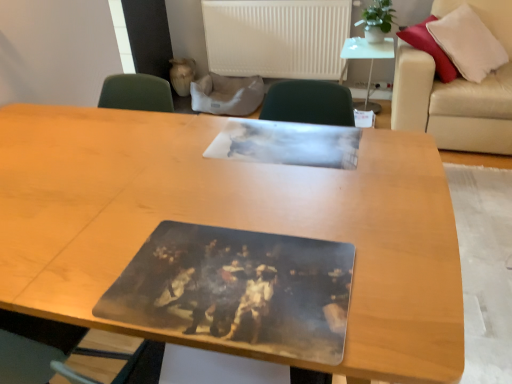
Identify the location of wooden table at center, the first table from the back. (366, 58).

Locate an element on the screen. beige leather couch at right is located at coordinates (457, 90).

From a real-world perspective, is wooden table at center, the first table from the back, physically above wooden table at center, positioned as the 2th table in right-to-left order?

Actually, wooden table at center, the first table from the back, is physically below wooden table at center, positioned as the 2th table in right-to-left order, in the real world.

Which object is further away from the camera taking this photo, wooden table at center, the second table positioned from the front, or wooden table at center, positioned as the 2th table in right-to-left order?

wooden table at center, the second table positioned from the front.

Considering the positions of objects wooden table at center, which is the second table from left to right, and wooden table at center, the 1th table ordered from the bottom, in the image provided, who is more to the left, wooden table at center, which is the second table from left to right, or wooden table at center, the 1th table ordered from the bottom,?

wooden table at center, the 1th table ordered from the bottom.

From the picture: Considering the sizes of objects wooden table at center, the first table from the back, and wooden table at center, arranged as the 1th table when viewed from the front, in the image provided, who is wider, wooden table at center, the first table from the back, or wooden table at center, arranged as the 1th table when viewed from the front,?

wooden table at center, arranged as the 1th table when viewed from the front, is wider.

Is wooden table at center, arranged as the second table when ordered from the bottom, directly adjacent to beige leather couch at right?

wooden table at center, arranged as the second table when ordered from the bottom, is not next to beige leather couch at right, and they're not touching.

Which is closer, (382, 57) or (473, 2)?

Point (382, 57) is farther from the camera than point (473, 2).

Considering the sizes of wooden table at center, the second table positioned from the front, and beige leather couch at right in the image, is wooden table at center, the second table positioned from the front, wider or thinner than beige leather couch at right?

Clearly, wooden table at center, the second table positioned from the front, has less width compared to beige leather couch at right.

Which object is more forward, wooden table at center, arranged as the second table when ordered from the bottom, or beige leather couch at right?

beige leather couch at right is closer to the camera.

From a real-world perspective, who is located higher, wooden table at center, which is the second table from left to right, or white matte radiator at upper center?

From a 3D spatial view, white matte radiator at upper center is above.

Considering the relative sizes of wooden table at center, the first table positioned from the top, and white matte radiator at upper center in the image provided, is wooden table at center, the first table positioned from the top, wider than white matte radiator at upper center?

Yes, wooden table at center, the first table positioned from the top, is wider than white matte radiator at upper center.

Consider the image. Considering the sizes of objects wooden table at center, arranged as the second table when ordered from the bottom, and white matte radiator at upper center in the image provided, who is taller, wooden table at center, arranged as the second table when ordered from the bottom, or white matte radiator at upper center?

white matte radiator at upper center is taller.

What's the angular difference between wooden table at center, which is the second table from left to right, and white matte radiator at upper center's facing directions?

0.454 degrees separate the facing orientations of wooden table at center, which is the second table from left to right, and white matte radiator at upper center.

From a real-world perspective, between beige leather couch at right and white matte radiator at upper center, who is vertically lower?

From a 3D spatial view, beige leather couch at right is below.

Is beige leather couch at right not close to white matte radiator at upper center?

Yes, beige leather couch at right and white matte radiator at upper center are quite far apart.

Is beige leather couch at right turned away from white matte radiator at upper center?

beige leather couch at right is not turned away from white matte radiator at upper center.

Is beige leather couch at right at the right side of white matte radiator at upper center?

Indeed, beige leather couch at right is positioned on the right side of white matte radiator at upper center.

From the image's perspective, which one is positioned higher, wooden table at center, arranged as the first table when viewed from the left, or beige leather couch at right?

beige leather couch at right.

Who is taller, wooden table at center, the 1th table ordered from the bottom, or beige leather couch at right?

Standing taller between the two is beige leather couch at right.

Is the position of wooden table at center, arranged as the first table when viewed from the left, less distant than that of beige leather couch at right?

Yes, it is in front of beige leather couch at right.

Is wooden table at center, arranged as the first table when viewed from the left, to the right of beige leather couch at right from the viewer's perspective?

No, wooden table at center, arranged as the first table when viewed from the left, is not to the right of beige leather couch at right.

Who is bigger, wooden table at center, the 1th table ordered from the bottom, or white matte radiator at upper center?

wooden table at center, the 1th table ordered from the bottom.

Is the depth of wooden table at center, the 1th table ordered from the bottom, less than that of white matte radiator at upper center?

Yes, wooden table at center, the 1th table ordered from the bottom, is closer to the viewer.

Is wooden table at center, arranged as the 1th table when viewed from the front, not within white matte radiator at upper center?

Absolutely, wooden table at center, arranged as the 1th table when viewed from the front, is external to white matte radiator at upper center.

Based on the photo, considering the sizes of objects wooden table at center, positioned as the 2th table in right-to-left order, and wooden table at center, which is the second table from left to right, in the image provided, who is bigger, wooden table at center, positioned as the 2th table in right-to-left order, or wooden table at center, which is the second table from left to right,?

wooden table at center, positioned as the 2th table in right-to-left order.

Is wooden table at center, arranged as the first table when viewed from the left, closer to the viewer compared to wooden table at center, which is the second table from left to right?

Yes, wooden table at center, arranged as the first table when viewed from the left, is closer to the camera.

Can you confirm if wooden table at center, the second table positioned from the top, is positioned to the right of wooden table at center, which is the second table from left to right?

No, wooden table at center, the second table positioned from the top, is not to the right of wooden table at center, which is the second table from left to right.

Which of these two, wooden table at center, marked as the 2th table in a back-to-front arrangement, or wooden table at center, arranged as the 1th table when viewed from the right, is wider?

wooden table at center, marked as the 2th table in a back-to-front arrangement, is wider.

The height and width of the screenshot is (384, 512). In order to click on table beneath the wooden table at center, the 1th table ordered from the bottom (from a real-world perspective) in this screenshot , I will do `click(366, 58)`.

Locate an element on the screen. table that is the 1st object located below the beige leather couch at right (from the image's perspective) is located at coordinates pyautogui.click(x=366, y=58).

Which object lies nearer to the anchor point beige leather couch at right, white matte radiator at upper center or wooden table at center, the second table positioned from the top?

The object closer to beige leather couch at right is white matte radiator at upper center.

Estimate the real-world distances between objects in this image. Which object is closer to white matte radiator at upper center, wooden table at center, the first table from the back, or wooden table at center, the second table positioned from the top?

wooden table at center, the first table from the back, is closer to white matte radiator at upper center.

Estimate the real-world distances between objects in this image. Which object is further from wooden table at center, the first table from the back, white matte radiator at upper center or wooden table at center, positioned as the 2th table in right-to-left order?

wooden table at center, positioned as the 2th table in right-to-left order.

Considering their positions, is beige leather couch at right positioned closer to wooden table at center, marked as the 2th table in a back-to-front arrangement, than wooden table at center, arranged as the 1th table when viewed from the right?

Among the two, beige leather couch at right is located nearer to wooden table at center, marked as the 2th table in a back-to-front arrangement.

From the image, which object appears to be nearer to wooden table at center, arranged as the first table when viewed from the left, wooden table at center, arranged as the second table when ordered from the bottom, or beige leather couch at right?

The object closer to wooden table at center, arranged as the first table when viewed from the left, is beige leather couch at right.

From the image, which object appears to be nearer to beige leather couch at right, white matte radiator at upper center or wooden table at center, which is the second table from left to right?

The object closer to beige leather couch at right is wooden table at center, which is the second table from left to right.

Which object lies nearer to the anchor point wooden table at center, which is the second table from left to right, wooden table at center, positioned as the 2th table in right-to-left order, or beige leather couch at right?

The object closer to wooden table at center, which is the second table from left to right, is beige leather couch at right.

Estimate the real-world distances between objects in this image. Which object is closer to white matte radiator at upper center, wooden table at center, positioned as the 2th table in right-to-left order, or beige leather couch at right?

Among the two, beige leather couch at right is located nearer to white matte radiator at upper center.

In order to click on couch positioned between wooden table at center, arranged as the 1th table when viewed from the front, and white matte radiator at upper center from near to far in this screenshot , I will do `click(457, 90)`.

Find the location of a particular element. The image size is (512, 384). table positioned between wooden table at center, the second table positioned from the top, and white matte radiator at upper center from near to far is located at coordinates point(366,58).

Image resolution: width=512 pixels, height=384 pixels. Find the location of `couch between wooden table at center, the second table positioned from the top, and wooden table at center, the first table positioned from the top, along the z-axis`. couch between wooden table at center, the second table positioned from the top, and wooden table at center, the first table positioned from the top, along the z-axis is located at coordinates click(x=457, y=90).

Find the location of a particular element. This screenshot has height=384, width=512. table between white matte radiator at upper center and beige leather couch at right from left to right is located at coordinates (366, 58).